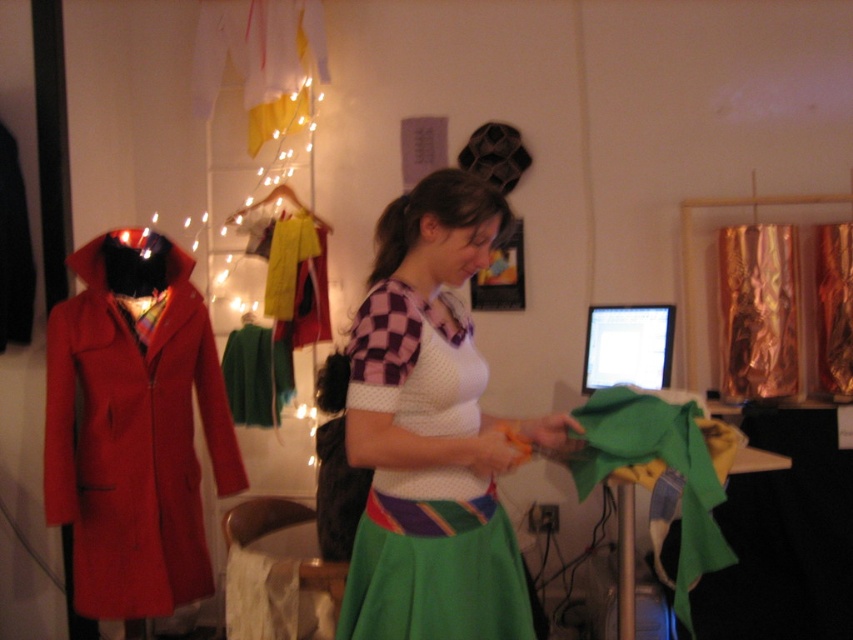
You are a tailor working in this space and need to place a 16 inch long ribbon between the white mesh top at center and the green felt at center. Based on the distance between them, will the ribbon fit perfectly without overlapping or needing to be shortened?

The distance between the white mesh top at center and green felt at center is 15.90 inches. Since the ribbon is 16 inches long, it is slightly longer than the space available. Therefore, the ribbon will need to be shortened by approximately 0.10 inches to fit between them without overlapping.

You are organizing a fashion show and need to arrange the matte red coat at left and the green felt at center. Which item should be placed closer to the audience to ensure visibility?

The matte red coat at left should be placed closer to the audience because it is already positioned further to the viewer than the green felt at center, making it more visible.

You are standing in the workspace and see two points marked in the image. The first point is at coordinate (479, 248) and the second is at (181, 468). From your perspective, which point is closer to you?

Point (479, 248) is in front of point (181, 468), so it is closer to you.